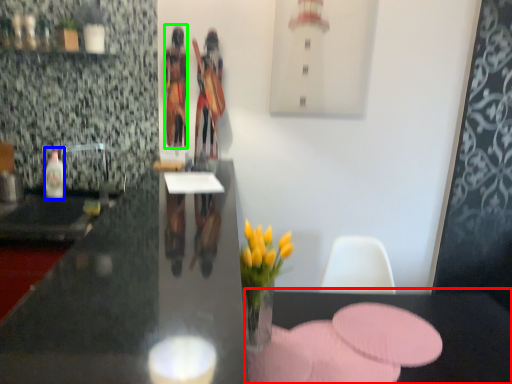
Question: Which object is positioned farthest from table (highlighted by a red box)? Select from bottle (highlighted by a blue box) and person (highlighted by a green box).

Choices:
 (A) bottle
 (B) person

Answer: (A)